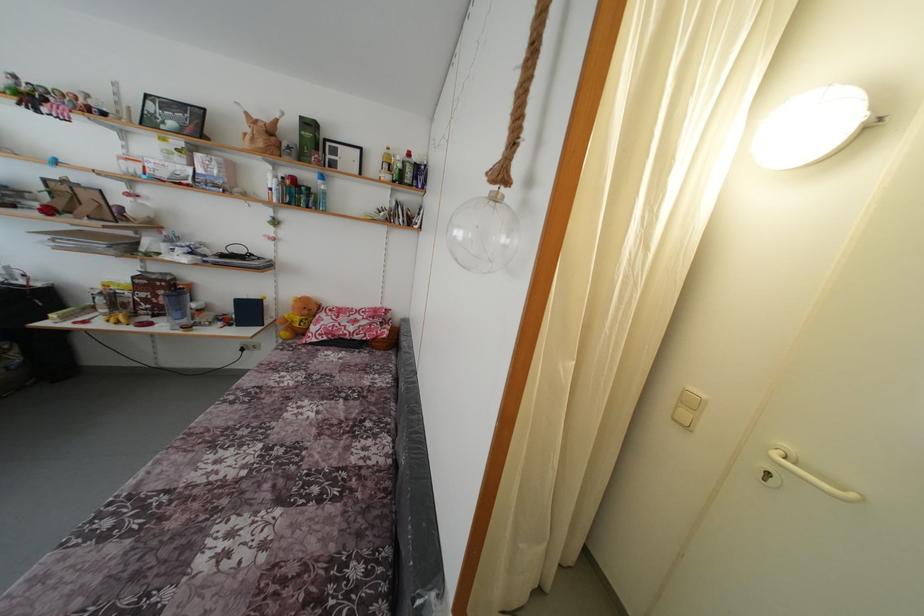
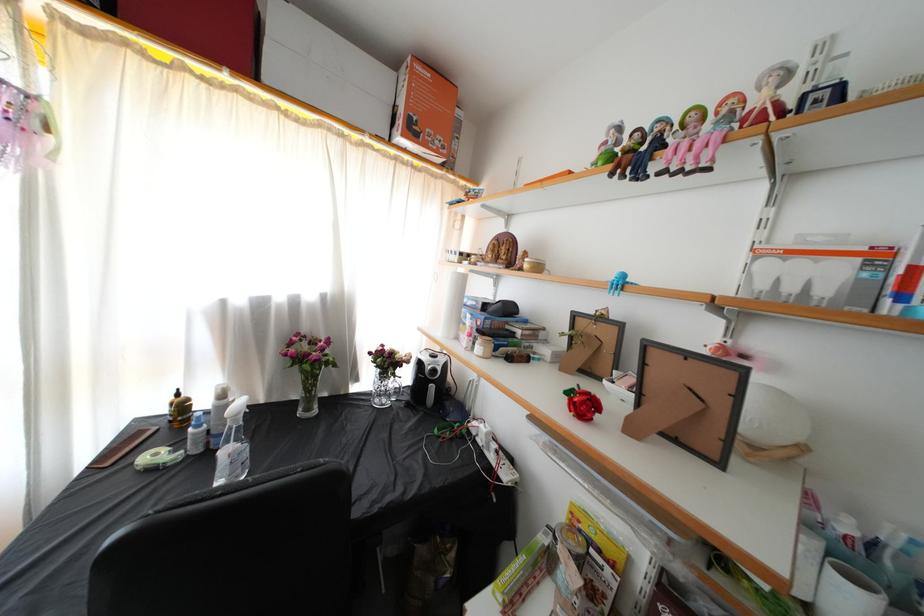
Locate, in the second image, the point that corresponds to [35,105] in the first image.

(638, 161)